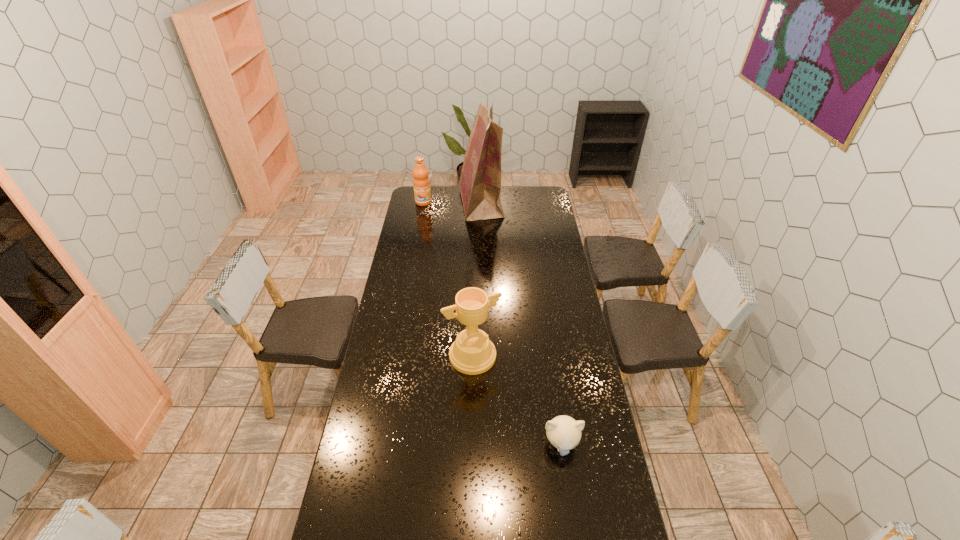
Select which object is the second closest to the second nearest object. Please provide its 2D coordinates. Your answer should be formatted as a tuple, i.e. [(x, y)], where the tuple contains the x and y coordinates of a point satisfying the conditions above.

[(480, 182)]

Find the location of a particular element. The image size is (960, 540). the second closest object relative to the shortest object is located at coordinates (480, 182).

Locate an element on the screen. This screenshot has height=540, width=960. vacant space that satisfies the following two spatial constraints: 1. on the label side of the fruit juice; 2. on the right side of the award is located at coordinates (396, 356).